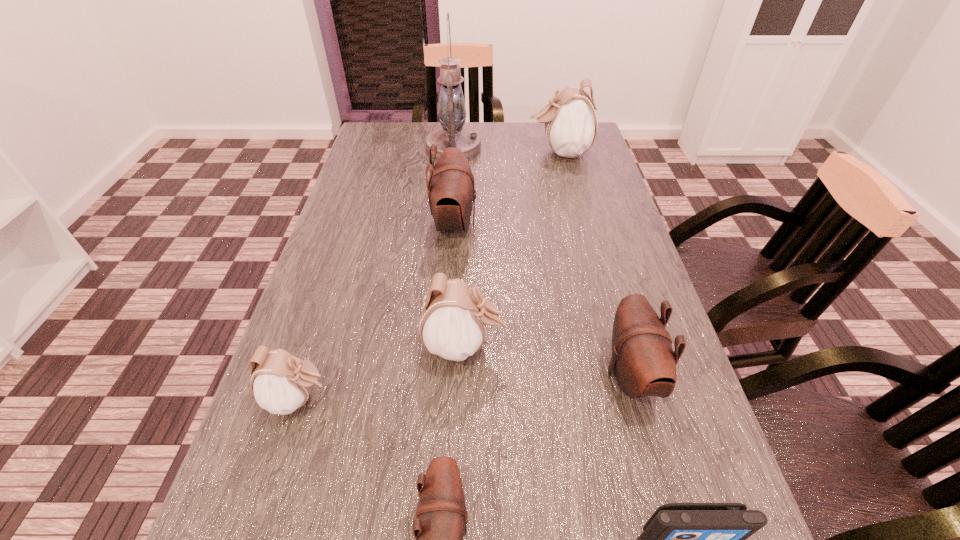
Where is `vacant space located on the right of the tallest object`? vacant space located on the right of the tallest object is located at coordinates (524, 148).

Identify the location of free space located on the front-facing side of the rightmost white pouch. (x=507, y=152).

Where is `free location located 0.290m on the front-facing side of the rightmost white pouch`? free location located 0.290m on the front-facing side of the rightmost white pouch is located at coordinates (438, 152).

The image size is (960, 540). I want to click on free location located on the front-facing side of the rightmost white pouch, so click(x=441, y=152).

Locate an element on the screen. free space located with the flap open on the farthest brown pouch is located at coordinates (553, 224).

The width and height of the screenshot is (960, 540). I want to click on free spot located 0.060m on the front-facing side of the second smallest white pouch, so click(535, 346).

You are a GUI agent. You are given a task and a screenshot of the screen. Output one action in this format:
    pyautogui.click(x=<x>, y=<y>)
    Task: Click on the free space located with the flap open on the second farthest brown pouch
    This screenshot has width=960, height=540.
    Given the screenshot: What is the action you would take?
    pyautogui.click(x=462, y=375)

This screenshot has height=540, width=960. Find the location of `vacant space located 0.160m with the flap open on the second farthest brown pouch`. vacant space located 0.160m with the flap open on the second farthest brown pouch is located at coordinates coord(520,375).

At what (x,y) coordinates should I click in order to perform the action: click on vacant point located 0.290m with the flap open on the second farthest brown pouch. Please return your answer as a coordinate pair (x, y). The height and width of the screenshot is (540, 960). Looking at the image, I should click on (451, 375).

You are a GUI agent. You are given a task and a screenshot of the screen. Output one action in this format:
    pyautogui.click(x=<x>, y=<y>)
    Task: Click on the vacant space situated 0.200m on the front-facing side of the leftmost object
    
    Given the screenshot: What is the action you would take?
    pyautogui.click(x=444, y=399)